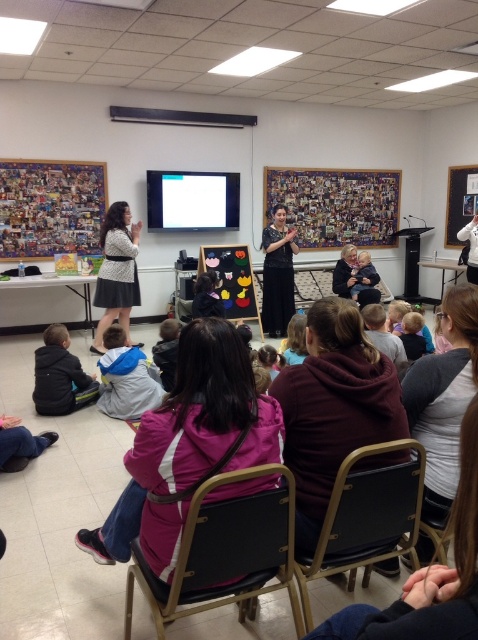
Is matte black dress at left to the right of black lace dress at center from the viewer's perspective?

In fact, matte black dress at left is to the left of black lace dress at center.

Does matte black dress at left appear over black lace dress at center?

Incorrect, matte black dress at left is not positioned above black lace dress at center.

Is point (117, 224) positioned in front of point (282, 220)?

Yes, point (117, 224) is in front of point (282, 220).

Where is `matte black dress at left`? The width and height of the screenshot is (478, 640). matte black dress at left is located at coordinates (117, 272).

Who is positioned more to the left, black fabric chair at lower center or black lace dress at center?

Positioned to the left is black fabric chair at lower center.

Who is higher up, black fabric chair at lower center or black lace dress at center?

black lace dress at center is above.

I want to click on black fabric chair at lower center, so coord(223,556).

Looking at this image, who is taller, black fabric chair at lower center or matte black dress at left?

matte black dress at left

Can you confirm if black fabric chair at lower center is shorter than matte black dress at left?

Indeed, black fabric chair at lower center has a lesser height compared to matte black dress at left.

Where is `black fabric chair at lower center`? black fabric chair at lower center is located at coordinates (223, 556).